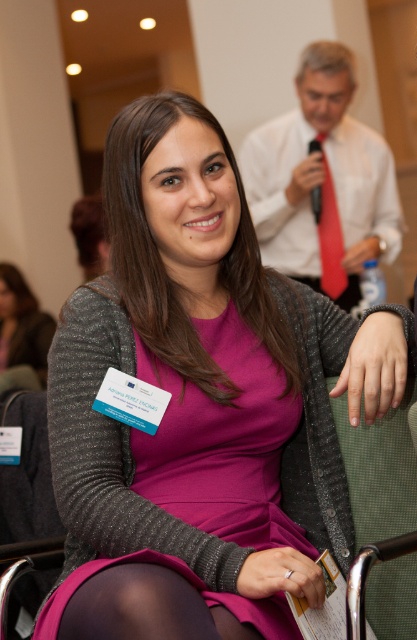
Question: Is matte gray cardigan at center smaller than silky red tie at center?

Choices:
 (A) yes
 (B) no

Answer: (B)

Question: Is matte gray cardigan at center closer to camera compared to silky red tie at center?

Choices:
 (A) yes
 (B) no

Answer: (B)

Question: Among these points, which one is farthest from the camera?

Choices:
 (A) (314, 148)
 (B) (32, 336)

Answer: (B)

Question: Does matte gray cardigan at center appear on the left side of silky red tie at center?

Choices:
 (A) yes
 (B) no

Answer: (A)